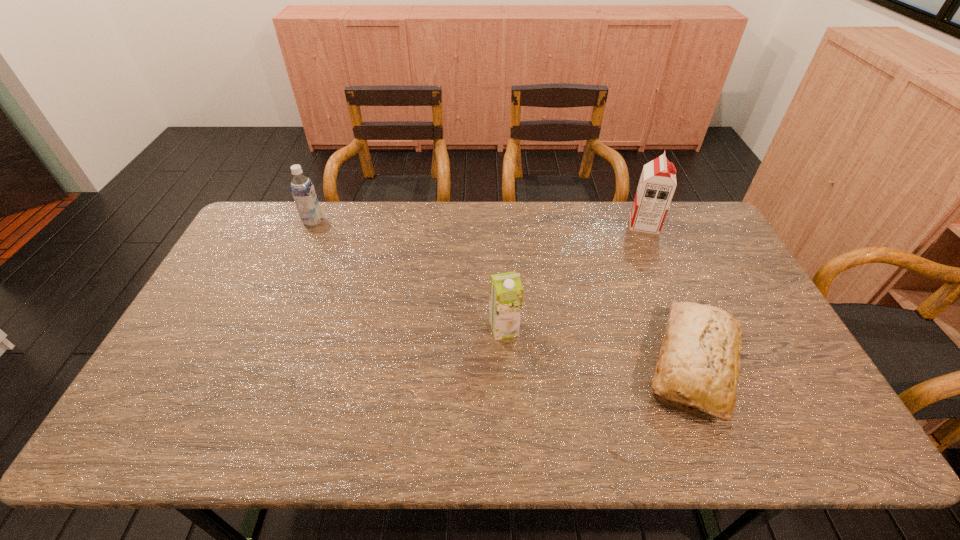
Where is `soya milk identified as the closest to the nearest soya milk`? The width and height of the screenshot is (960, 540). soya milk identified as the closest to the nearest soya milk is located at coordinates (657, 184).

Where is `free space that satisfies the following two spatial constraints: 1. on the label of the rightmost soya milk; 2. on the left side of the leftmost object`? free space that satisfies the following two spatial constraints: 1. on the label of the rightmost soya milk; 2. on the left side of the leftmost object is located at coordinates (312, 224).

Where is `vacant space that satisfies the following two spatial constraints: 1. on the label of the rightmost soya milk; 2. on the right side of the leftmost object`? The width and height of the screenshot is (960, 540). vacant space that satisfies the following two spatial constraints: 1. on the label of the rightmost soya milk; 2. on the right side of the leftmost object is located at coordinates (312, 224).

Where is `free space that satisfies the following two spatial constraints: 1. on the label of the leftmost soya milk; 2. on the right side of the bread`? free space that satisfies the following two spatial constraints: 1. on the label of the leftmost soya milk; 2. on the right side of the bread is located at coordinates (251, 366).

Find the location of a particular element. free space that satisfies the following two spatial constraints: 1. on the label of the shortest object; 2. on the right side of the leftmost object is located at coordinates (251, 366).

Locate an element on the screen. This screenshot has width=960, height=540. vacant space that satisfies the following two spatial constraints: 1. on the label of the leftmost object; 2. on the left side of the nearest soya milk is located at coordinates (267, 329).

The height and width of the screenshot is (540, 960). I want to click on vacant area in the image that satisfies the following two spatial constraints: 1. on the label of the leftmost object; 2. on the left side of the tallest object, so click(312, 224).

At what (x,y) coordinates should I click in order to perform the action: click on vacant area that satisfies the following two spatial constraints: 1. on the label of the leftmost object; 2. on the back side of the second soya milk from left to right. Please return your answer as a coordinate pair (x, y). Looking at the image, I should click on (267, 329).

At what (x,y) coordinates should I click in order to perform the action: click on free location that satisfies the following two spatial constraints: 1. on the label of the leftmost soya milk; 2. on the right side of the second object from left to right. Please return your answer as a coordinate pair (x, y). The image size is (960, 540). Looking at the image, I should click on [267, 329].

The image size is (960, 540). What are the coordinates of `free space in the image that satisfies the following two spatial constraints: 1. on the label of the leftmost object; 2. on the left side of the bread` in the screenshot? It's located at (251, 366).